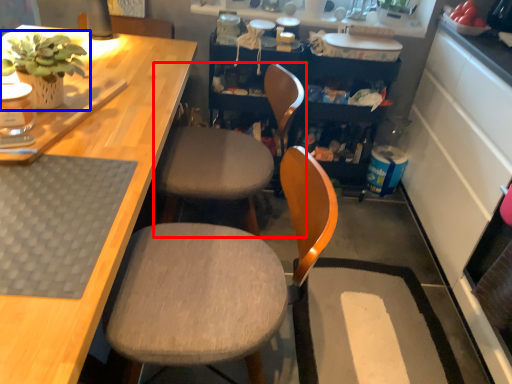
Question: Which object is closer to the camera taking this photo, chair (highlighted by a red box) or houseplant (highlighted by a blue box)?

Choices:
 (A) chair
 (B) houseplant

Answer: (B)